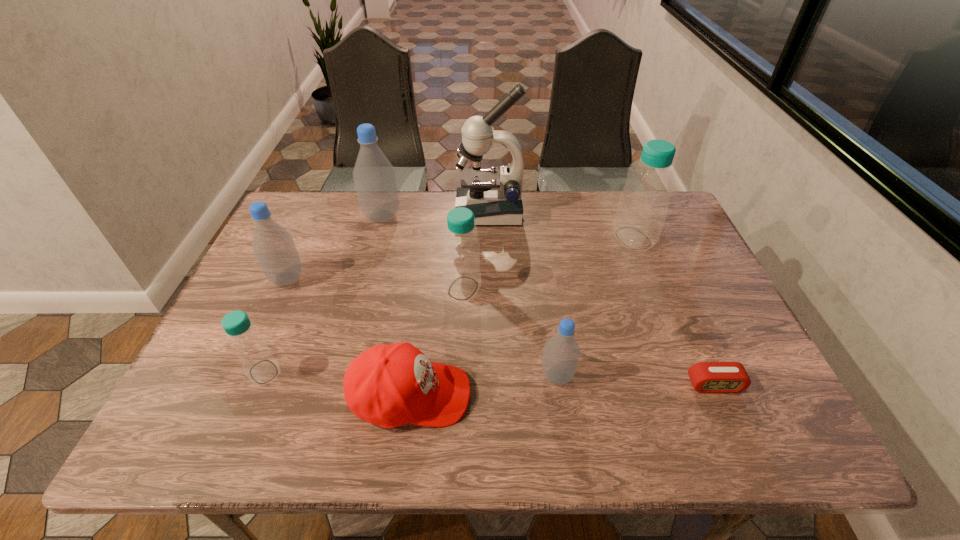
The image size is (960, 540). In order to click on the fifth bottle from left to right in this screenshot , I will do `click(561, 354)`.

At what (x,y) coordinates should I click in order to perform the action: click on the nearest blue bottle. Please return your answer as a coordinate pair (x, y). The height and width of the screenshot is (540, 960). Looking at the image, I should click on (243, 336).

What are the coordinates of `the leftmost blue bottle` in the screenshot? It's located at (243, 336).

Image resolution: width=960 pixels, height=540 pixels. What are the coordinates of `the second shortest object` in the screenshot? It's located at (389, 385).

This screenshot has height=540, width=960. In order to click on alarm clock in this screenshot , I will do `click(706, 377)`.

Where is `pink alarm clock`? This screenshot has width=960, height=540. pink alarm clock is located at coordinates (706, 377).

This screenshot has width=960, height=540. Find the location of `vacant space positioned 0.090m at the eyepiece of the microscope`. vacant space positioned 0.090m at the eyepiece of the microscope is located at coordinates coord(428,212).

This screenshot has width=960, height=540. Find the location of `vacant space located 0.400m at the eyepiece of the microscope`. vacant space located 0.400m at the eyepiece of the microscope is located at coordinates (331, 212).

Identify the location of vacant region located 0.280m at the eyepiece of the microscope. This screenshot has height=540, width=960. (369, 212).

Image resolution: width=960 pixels, height=540 pixels. Find the location of `free space located on the front of the second gray bottle from right to left`. free space located on the front of the second gray bottle from right to left is located at coordinates (364, 283).